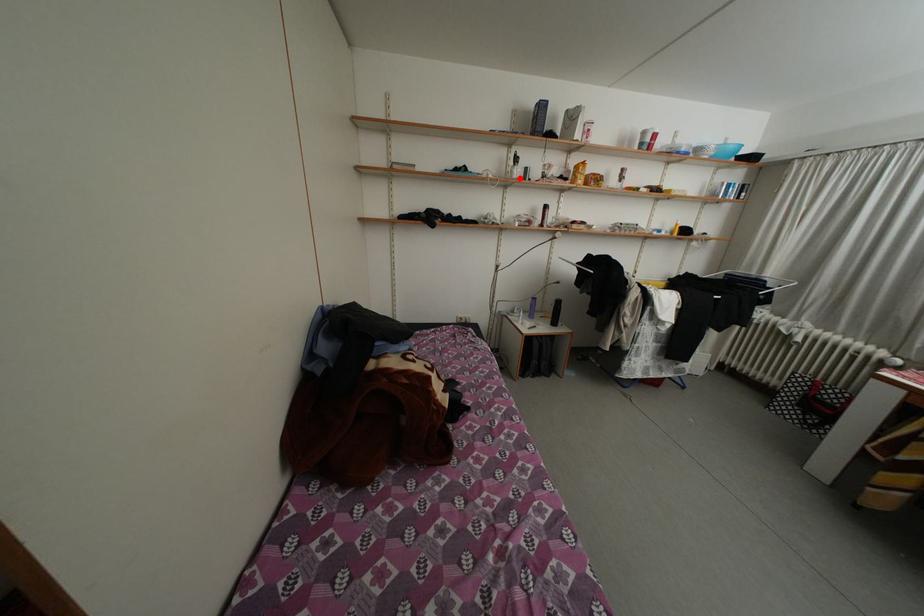
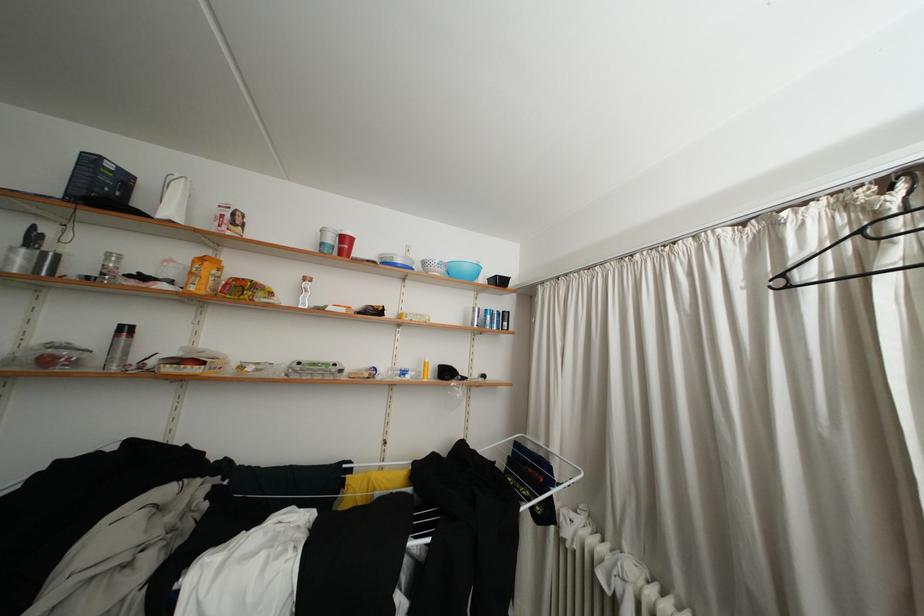
Question: I am providing you with two images of the same scene from different viewpoints. A red point is shown in image1. For the corresponding object point in image2, is it positioned nearer or farther from the camera?

Choices:
 (A) Nearer
 (B) Farther

Answer: (B)